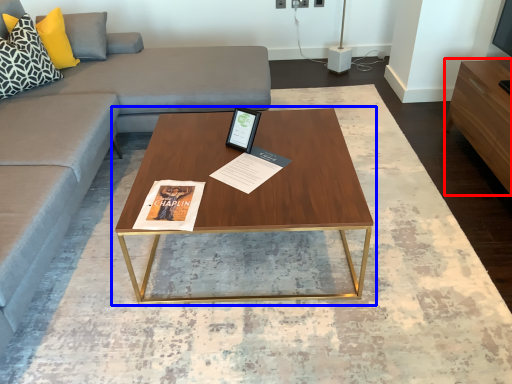
Question: Which object is further to the camera taking this photo, entertainment center (highlighted by a red box) or coffee table (highlighted by a blue box)?

Choices:
 (A) entertainment center
 (B) coffee table

Answer: (A)